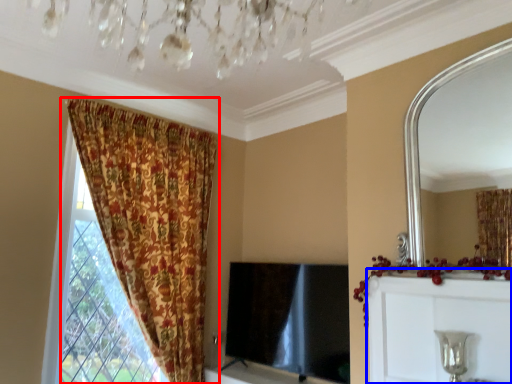
Question: Which object appears closest to the camera in this image, curtain (highlighted by a red box) or dresser (highlighted by a blue box)?

Choices:
 (A) curtain
 (B) dresser

Answer: (B)